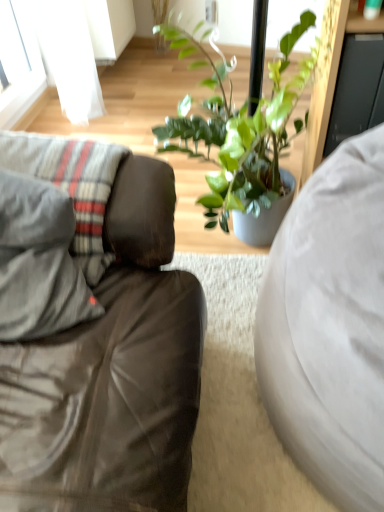
Question: Is there a large distance between matte gray couch at left, which appears as the 2th studio couch when viewed from the right, and gray fabric pillow at left?

Choices:
 (A) yes
 (B) no

Answer: (B)

Question: Is matte gray couch at left, the first studio couch positioned from the left, outside of gray fabric pillow at left?

Choices:
 (A) no
 (B) yes

Answer: (B)

Question: Is the depth of matte gray couch at left, which appears as the 2th studio couch when viewed from the right, less than that of gray fabric pillow at left?

Choices:
 (A) yes
 (B) no

Answer: (A)

Question: From a real-world perspective, does matte gray couch at left, the first studio couch positioned from the left, stand above gray fabric pillow at left?

Choices:
 (A) yes
 (B) no

Answer: (B)

Question: Does matte gray couch at left, the first studio couch positioned from the left, lie behind gray fabric pillow at left?

Choices:
 (A) yes
 (B) no

Answer: (B)

Question: Can you confirm if matte gray couch at left, the first studio couch positioned from the left, is thinner than gray fabric pillow at left?

Choices:
 (A) yes
 (B) no

Answer: (B)

Question: Does matte gray couch at left, the first studio couch positioned from the left, appear on the right side of white fabric studio couch at right, which is counted as the second studio couch, starting from the left?

Choices:
 (A) no
 (B) yes

Answer: (A)

Question: From the image's perspective, is matte gray couch at left, the first studio couch positioned from the left, under white fabric studio couch at right, which is counted as the second studio couch, starting from the left?

Choices:
 (A) yes
 (B) no

Answer: (B)

Question: Is matte gray couch at left, which appears as the 2th studio couch when viewed from the right, facing towards white fabric studio couch at right, which is counted as the second studio couch, starting from the left?

Choices:
 (A) yes
 (B) no

Answer: (A)

Question: From a real-world perspective, is matte gray couch at left, which appears as the 2th studio couch when viewed from the right, beneath white fabric studio couch at right, which is counted as the second studio couch, starting from the left?

Choices:
 (A) no
 (B) yes

Answer: (A)

Question: Is matte gray couch at left, the first studio couch positioned from the left, at the left side of white fabric studio couch at right, which is counted as the second studio couch, starting from the left?

Choices:
 (A) yes
 (B) no

Answer: (A)

Question: Is white fabric studio couch at right, which is counted as the second studio couch, starting from the left, surrounded by matte gray couch at left, the first studio couch positioned from the left?

Choices:
 (A) yes
 (B) no

Answer: (B)

Question: Is white fabric studio couch at right, which is counted as the second studio couch, starting from the left, thinner than matte gray couch at left, the first studio couch positioned from the left?

Choices:
 (A) no
 (B) yes

Answer: (A)